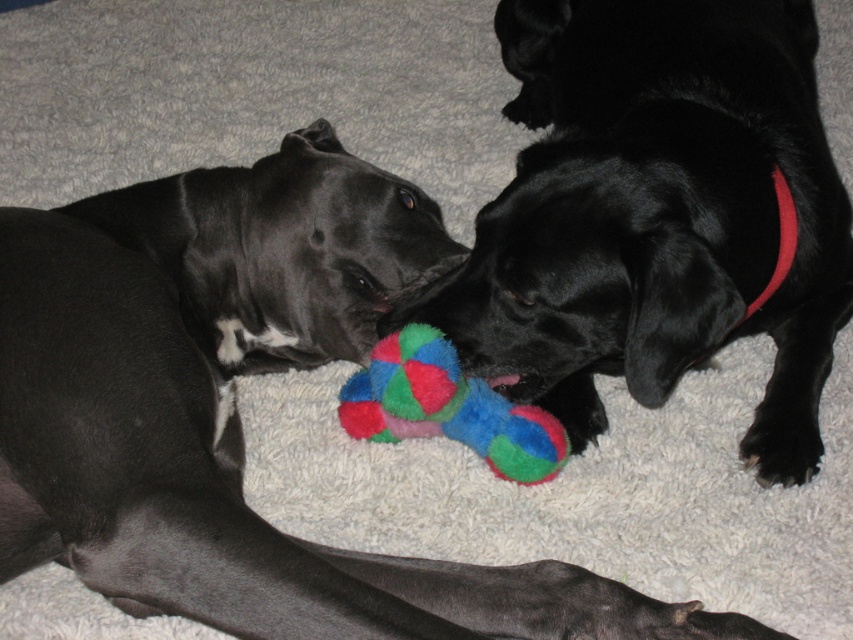
Looking at this image, is shiny black dog at center shorter than multicolored plush bone at center?

No.

Who is higher up, shiny black dog at center or multicolored plush bone at center?

shiny black dog at center

The width and height of the screenshot is (853, 640). In order to click on shiny black dog at center in this screenshot , I will do 654,216.

Where is `shiny black dog at center`? This screenshot has height=640, width=853. shiny black dog at center is located at coordinates tap(654, 216).